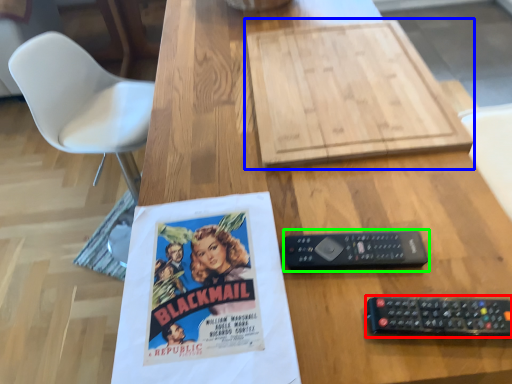
Question: Considering the real-world distances, which object is closest to remote control (highlighted by a red box)? cardboard (highlighted by a blue box) or control (highlighted by a green box).

Choices:
 (A) cardboard
 (B) control

Answer: (B)